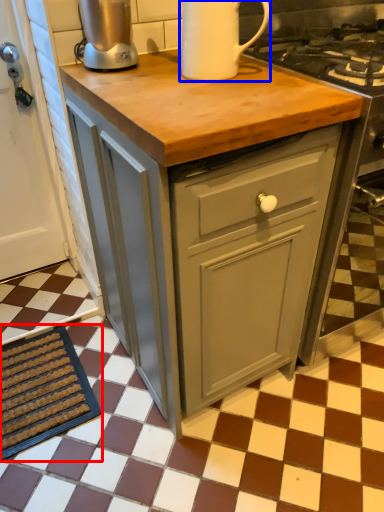
Question: Among these objects, which one is nearest to the camera, doormat (highlighted by a red box) or kitchen appliance (highlighted by a blue box)?

Choices:
 (A) doormat
 (B) kitchen appliance

Answer: (B)